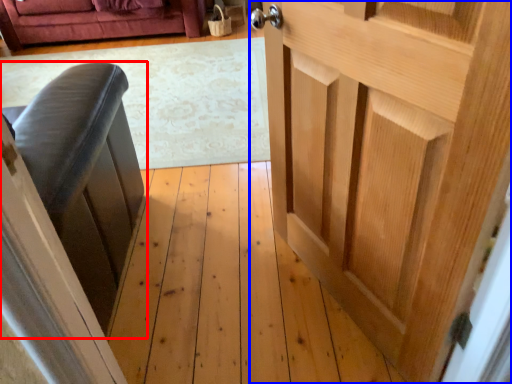
Question: Among these objects, which one is nearest to the camera, furniture (highlighted by a red box) or door (highlighted by a blue box)?

Choices:
 (A) furniture
 (B) door

Answer: (B)